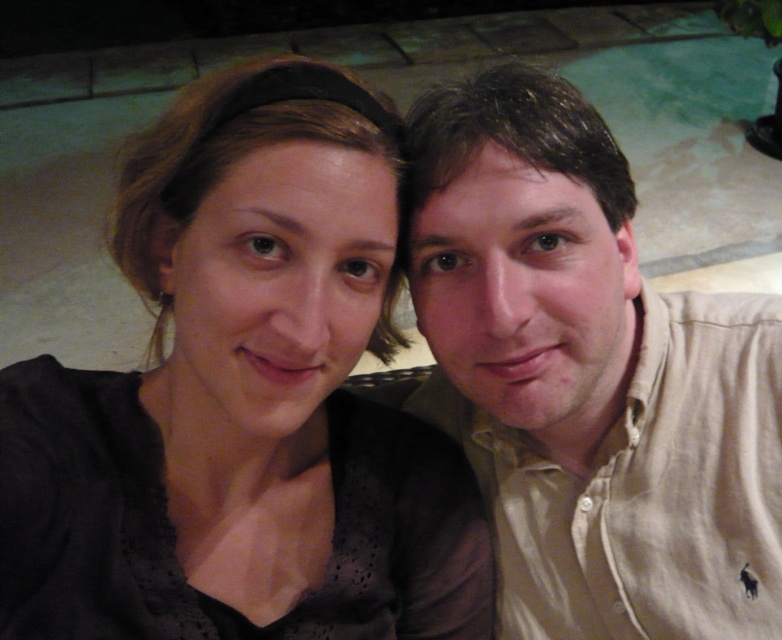
You are a photographer adjusting your camera settings to focus on the subjects in the image. Since you want to ensure both the matte black top at center and the beige cotton shirt at right are in focus, which one should you prioritize focusing on first to achieve the best depth of field?

You should prioritize focusing on the matte black top at center first because it is closer to the viewer than the beige cotton shirt at right. This will help ensure that the foreground subject remains sharp while the background gradually blurs, creating a natural depth of field effect.

You are a photographer adjusting lighting for a portrait. You need to ensure both the matte black top at center and the beige cotton shirt at right are evenly lit. Considering their sizes, which clothing item might require more focused lighting adjustments to avoid appearing too dark?

The matte black top at center is larger in size than the beige cotton shirt at right. Since larger dark surfaces can absorb more light, the matte black top at center might require more focused lighting adjustments to ensure it doesn not appear too dark compared to the beige cotton shirt at right.

You are standing in front of the two people in the image. Which of the two points, point (329, 476) or point (540, 112), is closer to you?

Point (329, 476) is closer to you because it is further to the viewer than point (540, 112).